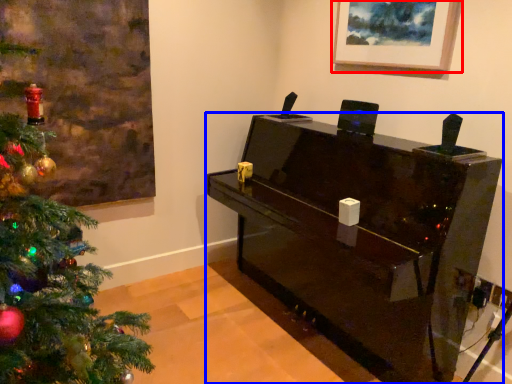
Question: Which point is further to the camera, picture frame (highlighted by a red box) or furniture (highlighted by a blue box)?

Choices:
 (A) picture frame
 (B) furniture

Answer: (A)